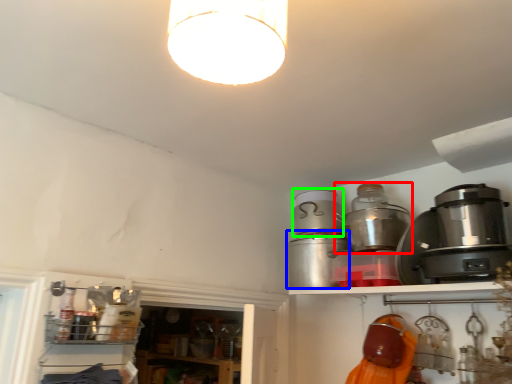
Question: Which object is the farthest from appliance (highlighted by a red box)? Choose among these: appliance (highlighted by a blue box) or appliance (highlighted by a green box).

Choices:
 (A) appliance
 (B) appliance

Answer: (A)